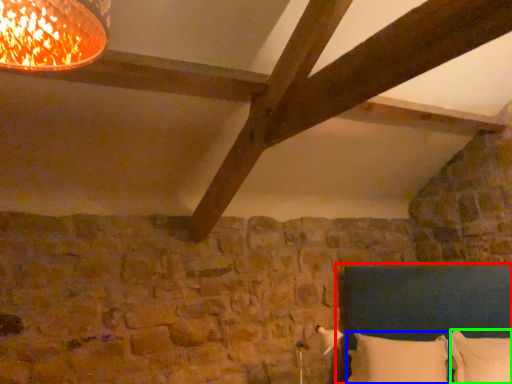
Question: Estimate the real-world distances between objects in this image. Which object is farther from bed (highlighted by a red box), pillow (highlighted by a blue box) or pillow (highlighted by a green box)?

Choices:
 (A) pillow
 (B) pillow

Answer: (B)